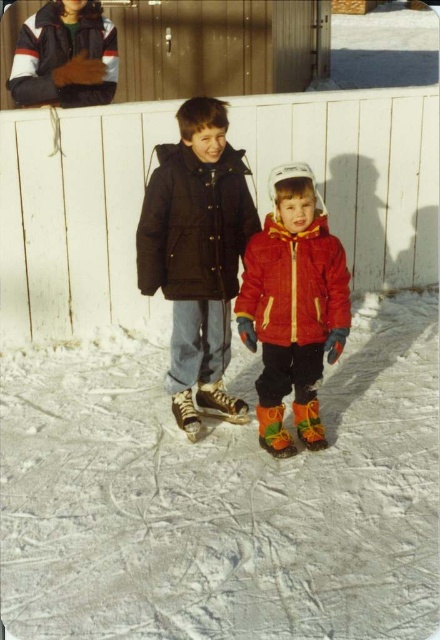
Locate an element on the screen. This screenshot has width=440, height=640. white matte ice at center is located at coordinates (223, 499).

The height and width of the screenshot is (640, 440). Describe the element at coordinates (223, 499) in the screenshot. I see `white matte ice at center` at that location.

Locate an element on the screen. This screenshot has height=640, width=440. white matte ice at center is located at coordinates (223, 499).

Is matte black jacket at center shorter than black puffy jacket at center?

No.

Who is taller, matte black jacket at center or black puffy jacket at center?

With more height is matte black jacket at center.

Between point (220, 157) and point (194, 157), which one is positioned in front?

Point (194, 157)

Identify the location of matte black jacket at center. The image size is (440, 640). (197, 256).

Between red matte jacket at center and brushed metal jacket at upper left, which one is positioned higher?

Positioned higher is brushed metal jacket at upper left.

Does red matte jacket at center appear over brushed metal jacket at upper left?

No.

Is point (345, 337) positioned behind point (62, 19)?

That is False.

The width and height of the screenshot is (440, 640). Identify the location of red matte jacket at center. (293, 307).